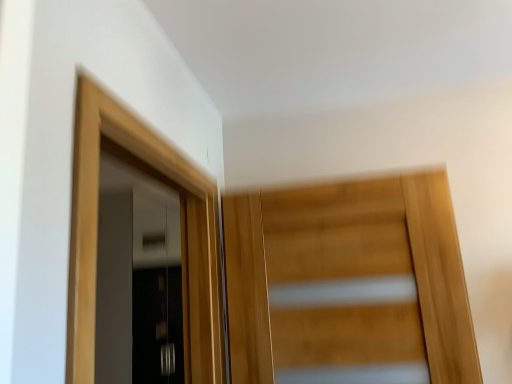
Where is `wooden door at center, which is the 1th door in right-to-left order`? This screenshot has height=384, width=512. wooden door at center, which is the 1th door in right-to-left order is located at coordinates (348, 281).

The image size is (512, 384). Describe the element at coordinates (181, 233) in the screenshot. I see `light wood door at upper left, which appears as the 3th door when viewed from the back` at that location.

The width and height of the screenshot is (512, 384). I want to click on wooden door at center, which is the 1th door in right-to-left order, so click(x=348, y=281).

Is matte black door at left, which is the third door from front to back, located outside light wood door at upper left, which is the 2th door from left to right?

Yes, matte black door at left, which is the third door from front to back, is outside of light wood door at upper left, which is the 2th door from left to right.

Which of these two, matte black door at left, which is the third door from front to back, or light wood door at upper left, the 1th door viewed from the front, is bigger?

matte black door at left, which is the third door from front to back, is bigger.

Is the position of matte black door at left, marked as the 3th door in a right-to-left arrangement, less distant than that of light wood door at upper left, marked as the 2th door in a right-to-left arrangement?

That is False.

Which is more to the right, matte black door at left, which is the third door from front to back, or light wood door at upper left, the 1th door viewed from the front?

light wood door at upper left, the 1th door viewed from the front.

From the picture: From a real-world perspective, between light wood door at upper left, which is the 2th door from left to right, and matte black door at left, which ranks as the first door in back-to-front order, who is vertically higher?

In real-world perspective, light wood door at upper left, which is the 2th door from left to right, is above.

How far apart are light wood door at upper left, which appears as the 3th door when viewed from the back, and matte black door at left, which ranks as the first door in back-to-front order?

light wood door at upper left, which appears as the 3th door when viewed from the back, is 2.68 meters from matte black door at left, which ranks as the first door in back-to-front order.

Considering the positions of objects light wood door at upper left, which appears as the 3th door when viewed from the back, and matte black door at left, which ranks as the first door in back-to-front order, in the image provided, who is more to the right, light wood door at upper left, which appears as the 3th door when viewed from the back, or matte black door at left, which ranks as the first door in back-to-front order,?

light wood door at upper left, which appears as the 3th door when viewed from the back.

From the image's perspective, is light wood door at upper left, which appears as the 3th door when viewed from the back, above or below matte black door at left, which is the third door from front to back?

light wood door at upper left, which appears as the 3th door when viewed from the back, is above matte black door at left, which is the third door from front to back.

The image size is (512, 384). In order to click on door above the wooden door at center, the 2th door from the back (from a real-world perspective) in this screenshot , I will do `click(181, 233)`.

From the picture: Is light wood door at upper left, the 1th door viewed from the front, at the back of wooden door at center, the 2th door from the back?

No.

Looking at this image, choose the correct answer: Is wooden door at center, the 3th door viewed from the left, inside light wood door at upper left, which is the 2th door from left to right, or outside it?

wooden door at center, the 3th door viewed from the left, is outside light wood door at upper left, which is the 2th door from left to right.

How far apart are matte black door at left, the 1th door when ordered from left to right, and wooden door at center, positioned as the 2th door in front-to-back order?

A distance of 2.63 meters exists between matte black door at left, the 1th door when ordered from left to right, and wooden door at center, positioned as the 2th door in front-to-back order.

At what (x,y) coordinates should I click in order to perform the action: click on door directly beneath the wooden door at center, the 2th door from the back (from a real-world perspective). Please return your answer as a coordinate pair (x, y). Looking at the image, I should click on (137, 274).

Based on the photo, can you tell me how much matte black door at left, which is the third door from front to back, and wooden door at center, positioned as the 2th door in front-to-back order, differ in facing direction?

There is a 89-degree angle between the facing directions of matte black door at left, which is the third door from front to back, and wooden door at center, positioned as the 2th door in front-to-back order.

From a real-world perspective, who is located higher, matte black door at left, marked as the 3th door in a right-to-left arrangement, or wooden door at center, the 2th door from the back?

wooden door at center, the 2th door from the back, from a real-world perspective.

From a real-world perspective, is light wood door at upper left, the 1th door viewed from the front, positioned above or below wooden door at center, which is the 1th door in right-to-left order?

From a real-world perspective, light wood door at upper left, the 1th door viewed from the front, is physically above wooden door at center, which is the 1th door in right-to-left order.

Does light wood door at upper left, the 1th door viewed from the front, have a larger size compared to wooden door at center, positioned as the 2th door in front-to-back order?

Indeed, light wood door at upper left, the 1th door viewed from the front, has a larger size compared to wooden door at center, positioned as the 2th door in front-to-back order.

What's the angular difference between light wood door at upper left, which is the 2th door from left to right, and wooden door at center, the 2th door from the back,'s facing directions?

90.4 degrees separate the facing orientations of light wood door at upper left, which is the 2th door from left to right, and wooden door at center, the 2th door from the back.

Looking at this image, is light wood door at upper left, marked as the 2th door in a right-to-left arrangement, taller than wooden door at center, which is the 1th door in right-to-left order?

Indeed, light wood door at upper left, marked as the 2th door in a right-to-left arrangement, has a greater height compared to wooden door at center, which is the 1th door in right-to-left order.

How different are the orientations of wooden door at center, which is the 1th door in right-to-left order, and matte black door at left, the 1th door when ordered from left to right, in degrees?

They differ by 89 degrees in their facing directions.

From a real-world perspective, is wooden door at center, the 2th door from the back, on top of matte black door at left, the 1th door when ordered from left to right?

Indeed, from a real-world perspective, wooden door at center, the 2th door from the back, stands above matte black door at left, the 1th door when ordered from left to right.

Is wooden door at center, which is the 1th door in right-to-left order, surrounding matte black door at left, the 1th door when ordered from left to right?

Definitely not — matte black door at left, the 1th door when ordered from left to right, is not inside wooden door at center, which is the 1th door in right-to-left order.

From the image's perspective, count 2nd doors upward from the matte black door at left, which is the third door from front to back, and point to it. Please provide its 2D coordinates.

[(181, 233)]

Where is `door located on the left of light wood door at upper left, the 1th door viewed from the front`? door located on the left of light wood door at upper left, the 1th door viewed from the front is located at coordinates (137, 274).

Which object lies further to the anchor point light wood door at upper left, which is the 2th door from left to right, wooden door at center, which is the 1th door in right-to-left order, or matte black door at left, which is the third door from front to back?

Based on the image, matte black door at left, which is the third door from front to back, appears to be further to light wood door at upper left, which is the 2th door from left to right.

Looking at this image, when comparing their distances from light wood door at upper left, which appears as the 3th door when viewed from the back, does matte black door at left, marked as the 3th door in a right-to-left arrangement, or wooden door at center, the 2th door from the back, seem further?

matte black door at left, marked as the 3th door in a right-to-left arrangement.

Considering their positions, is matte black door at left, the 1th door when ordered from left to right, positioned closer to wooden door at center, the 3th door viewed from the left, than light wood door at upper left, which is the 2th door from left to right?

Among the two, light wood door at upper left, which is the 2th door from left to right, is located nearer to wooden door at center, the 3th door viewed from the left.

Looking at the image, which one is located closer to wooden door at center, the 2th door from the back, light wood door at upper left, which is the 2th door from left to right, or matte black door at left, the 1th door when ordered from left to right?

light wood door at upper left, which is the 2th door from left to right.

When comparing their distances from matte black door at left, marked as the 3th door in a right-to-left arrangement, does wooden door at center, the 3th door viewed from the left, or light wood door at upper left, the 1th door viewed from the front, seem closer?

wooden door at center, the 3th door viewed from the left, lies closer to matte black door at left, marked as the 3th door in a right-to-left arrangement, than the other object.

From the picture: From the image, which object appears to be nearer to matte black door at left, the 1th door when ordered from left to right, light wood door at upper left, marked as the 2th door in a right-to-left arrangement, or wooden door at center, the 3th door viewed from the left?

Based on the image, wooden door at center, the 3th door viewed from the left, appears to be nearer to matte black door at left, the 1th door when ordered from left to right.

What are the coordinates of `door between light wood door at upper left, which is the 2th door from left to right, and matte black door at left, which is the third door from front to back, along the z-axis` in the screenshot? It's located at (348, 281).